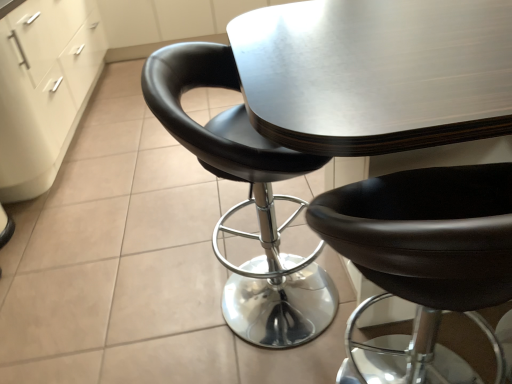
What do you see at coordinates (44, 88) in the screenshot? I see `white matte file cabinet at lower left` at bounding box center [44, 88].

Image resolution: width=512 pixels, height=384 pixels. What do you see at coordinates (247, 200) in the screenshot?
I see `black leather chair at center, which is the 2th chair from right to left` at bounding box center [247, 200].

At what (x,y) coordinates should I click in order to perform the action: click on white matte file cabinet at lower left. Please return your answer as a coordinate pair (x, y). Looking at the image, I should click on (44, 88).

Is white matte file cabinet at lower left taller or shorter than black leather chair at center, which is the 1th chair from left to right?

Clearly, white matte file cabinet at lower left is taller compared to black leather chair at center, which is the 1th chair from left to right.

How different are the orientations of white matte file cabinet at lower left and black leather chair at center, which is the 2th chair from right to left, in degrees?

white matte file cabinet at lower left and black leather chair at center, which is the 2th chair from right to left, are facing 2.6 degrees away from each other.

Which object is thinner, white matte file cabinet at lower left or black leather chair at center, which is the 1th chair from left to right?

Thinner between the two is black leather chair at center, which is the 1th chair from left to right.

Can you confirm if white matte file cabinet at lower left is positioned to the left of black leather chair at center, which is the 1th chair from left to right?

Indeed, white matte file cabinet at lower left is positioned on the left side of black leather chair at center, which is the 1th chair from left to right.

Looking at this image, which is closer to the camera, [263,256] or [42,41]?

Clearly, point [263,256] is closer to the camera than point [42,41].

Is black leather chair at center, which is the 2th chair from right to left, taller or shorter than white matte file cabinet at lower left?

Clearly, black leather chair at center, which is the 2th chair from right to left, is shorter compared to white matte file cabinet at lower left.

From a real-world perspective, is black leather chair at center, which is the 2th chair from right to left, on top of white matte file cabinet at lower left?

No, from a real-world perspective, black leather chair at center, which is the 2th chair from right to left, is not over white matte file cabinet at lower left

From the image's perspective, which one is positioned higher, white matte file cabinet at lower left or black leather chair at center, the second chair viewed from the left?

From the image's view, white matte file cabinet at lower left is above.

Measure the distance between white matte file cabinet at lower left and black leather chair at center, the first chair in the right-to-left sequence.

white matte file cabinet at lower left and black leather chair at center, the first chair in the right-to-left sequence, are 1.97 meters apart.

Which of these two, white matte file cabinet at lower left or black leather chair at center, the second chair viewed from the left, is thinner?

With smaller width is black leather chair at center, the second chair viewed from the left.

Considering the points (39, 140) and (367, 218), which point is behind, point (39, 140) or point (367, 218)?

The point (39, 140) is behind.

Is black leather chair at center, which is the 1th chair from left to right, looking in the opposite direction of black leather chair at center, the first chair in the right-to-left sequence?

black leather chair at center, which is the 1th chair from left to right, does not have its back to black leather chair at center, the first chair in the right-to-left sequence.

Is the depth of black leather chair at center, which is the 1th chair from left to right, less than that of black leather chair at center, the first chair in the right-to-left sequence?

No, black leather chair at center, which is the 1th chair from left to right, is further to the viewer.

From a real-world perspective, between black leather chair at center, which is the 1th chair from left to right, and black leather chair at center, the second chair viewed from the left, who is vertically higher?

In real-world perspective, black leather chair at center, which is the 1th chair from left to right, is above.

Based on the photo, considering the sizes of black leather chair at center, which is the 1th chair from left to right, and black leather chair at center, the first chair in the right-to-left sequence, in the image, is black leather chair at center, which is the 1th chair from left to right, bigger or smaller than black leather chair at center, the first chair in the right-to-left sequence,?

black leather chair at center, which is the 1th chair from left to right, is bigger than black leather chair at center, the first chair in the right-to-left sequence.

Is black leather chair at center, the second chair viewed from the left, completely or partially outside of black leather chair at center, which is the 1th chair from left to right?

Yes.

Is black leather chair at center, the first chair in the right-to-left sequence, aimed at black leather chair at center, which is the 2th chair from right to left?

No, black leather chair at center, the first chair in the right-to-left sequence, is not facing towards black leather chair at center, which is the 2th chair from right to left.

Considering the sizes of objects black leather chair at center, the second chair viewed from the left, and black leather chair at center, which is the 1th chair from left to right, in the image provided, who is bigger, black leather chair at center, the second chair viewed from the left, or black leather chair at center, which is the 1th chair from left to right,?

Bigger between the two is black leather chair at center, which is the 1th chair from left to right.

Does black leather chair at center, the first chair in the right-to-left sequence, have a greater height compared to black leather chair at center, which is the 2th chair from right to left?

In fact, black leather chair at center, the first chair in the right-to-left sequence, may be shorter than black leather chair at center, which is the 2th chair from right to left.

Could white matte file cabinet at lower left be considered to be inside black leather chair at center, the first chair in the right-to-left sequence?

Actually, white matte file cabinet at lower left is outside black leather chair at center, the first chair in the right-to-left sequence.

Is black leather chair at center, the first chair in the right-to-left sequence, in contact with white matte file cabinet at lower left?

No, black leather chair at center, the first chair in the right-to-left sequence, is not touching white matte file cabinet at lower left.

Looking at this image, can you confirm if black leather chair at center, the second chair viewed from the left, is smaller than white matte file cabinet at lower left?

Yes, black leather chair at center, the second chair viewed from the left, is smaller than white matte file cabinet at lower left.

Is point (490, 166) closer or farther from the camera than point (7, 149)?

Point (490, 166) is closer to the camera than point (7, 149).

From the image's perspective, which chair is the 1st one below the white matte file cabinet at lower left? Please provide its 2D coordinates.

[(247, 200)]

Find the location of a particular element. file cabinet on the left of black leather chair at center, which is the 2th chair from right to left is located at coordinates (44, 88).

Looking at the image, which one is located closer to white matte file cabinet at lower left, black leather chair at center, the second chair viewed from the left, or black leather chair at center, which is the 1th chair from left to right?

Based on the image, black leather chair at center, which is the 1th chair from left to right, appears to be nearer to white matte file cabinet at lower left.

Which object lies further to the anchor point white matte file cabinet at lower left, black leather chair at center, which is the 2th chair from right to left, or black leather chair at center, the second chair viewed from the left?

black leather chair at center, the second chair viewed from the left, lies further to white matte file cabinet at lower left than the other object.

Based on the photo, looking at the image, which one is located further to black leather chair at center, the second chair viewed from the left, white matte file cabinet at lower left or black leather chair at center, which is the 1th chair from left to right?

Based on the image, white matte file cabinet at lower left appears to be further to black leather chair at center, the second chair viewed from the left.

Estimate the real-world distances between objects in this image. Which object is further from black leather chair at center, which is the 2th chair from right to left, black leather chair at center, the second chair viewed from the left, or white matte file cabinet at lower left?

The object further to black leather chair at center, which is the 2th chair from right to left, is white matte file cabinet at lower left.

From the image, which object appears to be nearer to black leather chair at center, which is the 1th chair from left to right, white matte file cabinet at lower left or black leather chair at center, the first chair in the right-to-left sequence?

The object closer to black leather chair at center, which is the 1th chair from left to right, is black leather chair at center, the first chair in the right-to-left sequence.

Which object lies nearer to the anchor point black leather chair at center, the first chair in the right-to-left sequence, black leather chair at center, which is the 2th chair from right to left, or white matte file cabinet at lower left?

The object closer to black leather chair at center, the first chair in the right-to-left sequence, is black leather chair at center, which is the 2th chair from right to left.

You are a GUI agent. You are given a task and a screenshot of the screen. Output one action in this format:
    pyautogui.click(x=<x>, y=<y>)
    Task: Click on the chair situated between white matte file cabinet at lower left and black leather chair at center, the first chair in the right-to-left sequence, from left to right
    Image resolution: width=512 pixels, height=384 pixels.
    Given the screenshot: What is the action you would take?
    pyautogui.click(x=247, y=200)